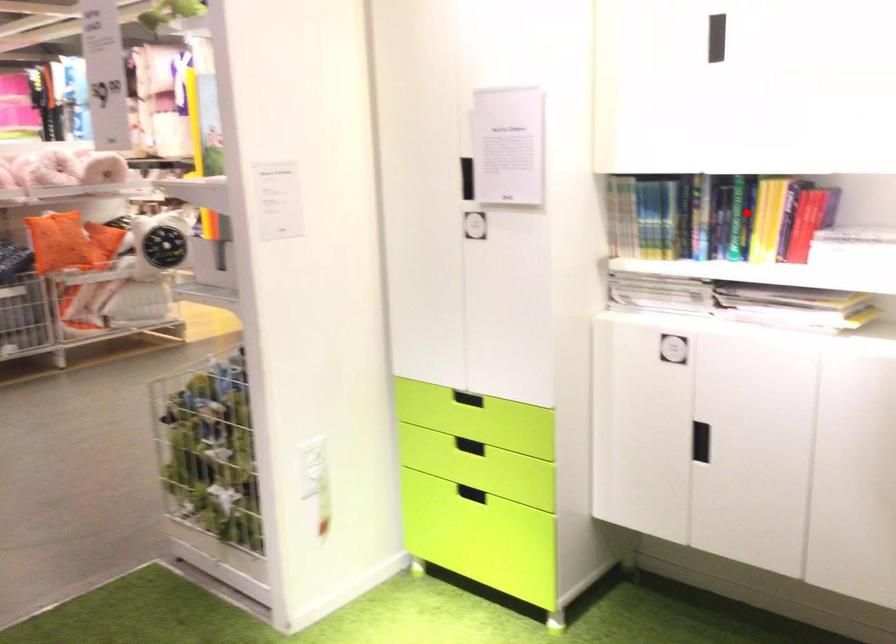
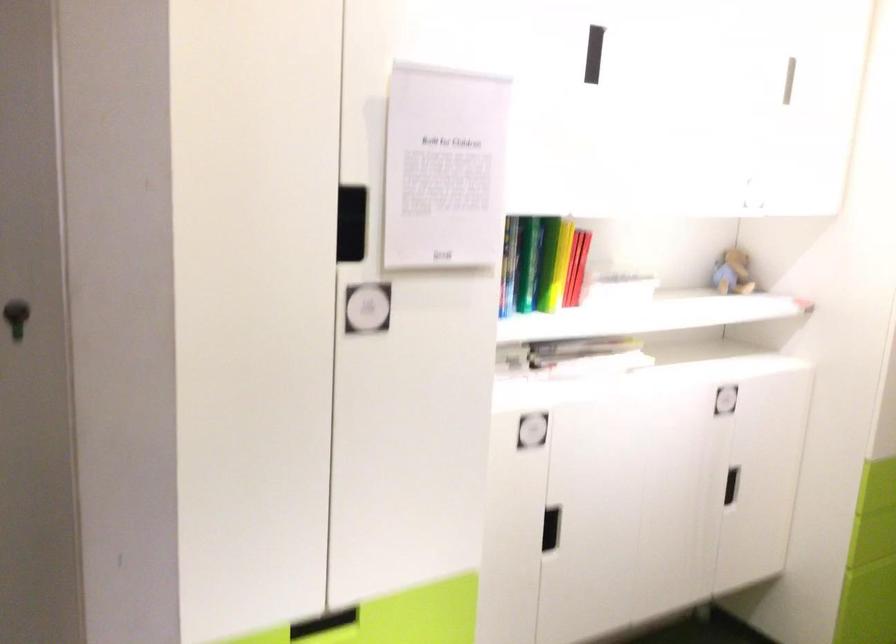
Question: I am providing you with two images of the same scene from different viewpoints. A red point is shown in image1. For the corresponding object point in image2, is it positioned nearer or farther from the camera?

Choices:
 (A) Nearer
 (B) Farther

Answer: (A)